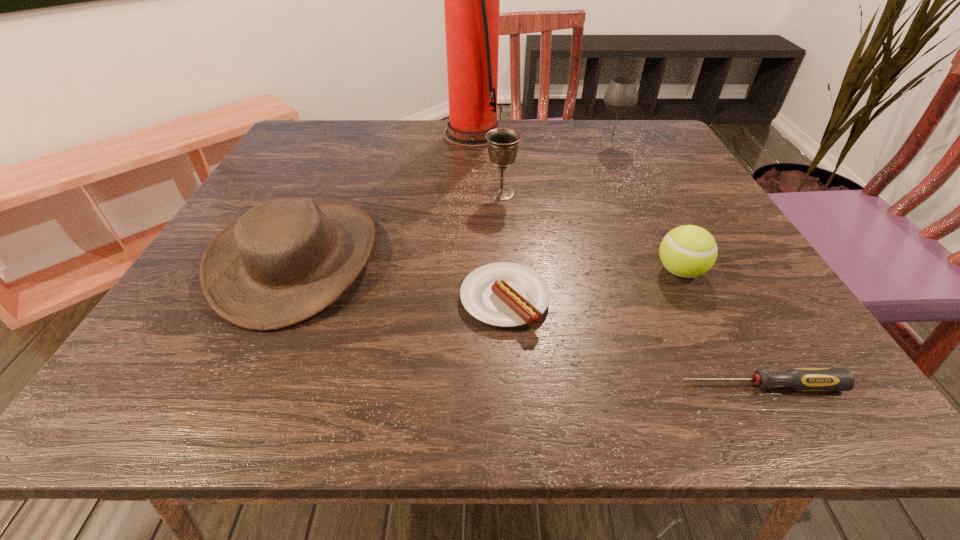
The image size is (960, 540). Identify the location of vacant area situated 0.050m on the left of the second tallest object. (576, 144).

The image size is (960, 540). I want to click on blank space located on the left of the fifth nearest object, so click(300, 193).

This screenshot has width=960, height=540. What are the coordinates of `free point located 0.100m on the front of the leftmost object` in the screenshot? It's located at (237, 389).

The image size is (960, 540). Identify the location of free space located 0.250m on the left of the tennis ball. (513, 271).

Image resolution: width=960 pixels, height=540 pixels. I want to click on vacant space located 0.130m on the back of the sausage, so click(500, 225).

Find the location of a particular element. blank area located insert the nearest object into a screw head is located at coordinates (460, 386).

At what (x,y) coordinates should I click in order to perform the action: click on free point located insert the nearest object into a screw head. Please return your answer as a coordinate pair (x, y). Looking at the image, I should click on pos(490,386).

The width and height of the screenshot is (960, 540). Find the location of `vacant space located insert the nearest object into a screw head`. vacant space located insert the nearest object into a screw head is located at coordinates (423, 386).

Find the location of `fire extinguisher that is at the far edge`. fire extinguisher that is at the far edge is located at coordinates (471, 0).

Identify the location of wineglass situated at the far edge. The width and height of the screenshot is (960, 540). (621, 95).